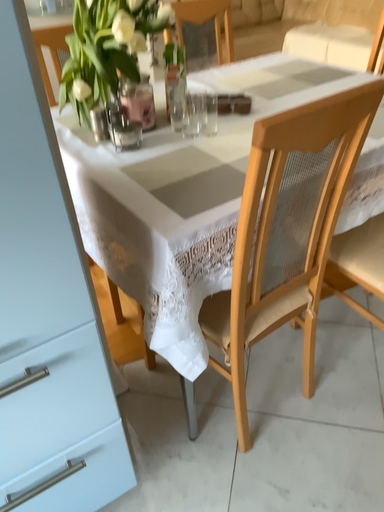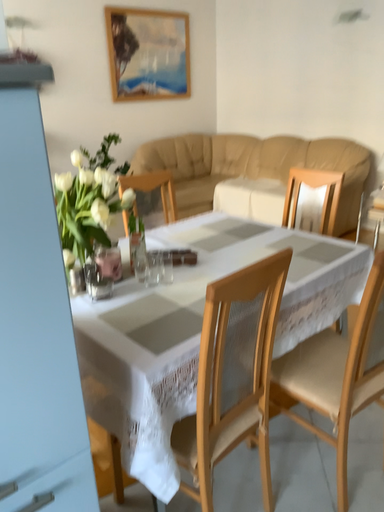
Question: Which way did the camera rotate in the video?

Choices:
 (A) rotated left
 (B) rotated right

Answer: (B)